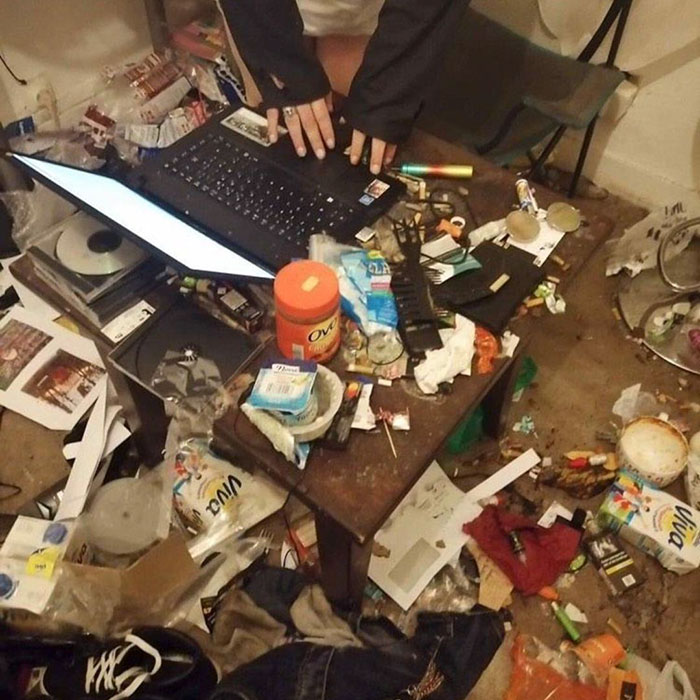
Locate an element on the screen. This screenshot has width=700, height=700. laptop screen is located at coordinates (172, 242).